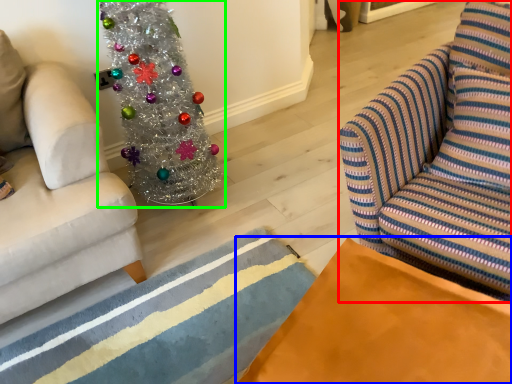
Question: Which object is the farthest from swivel chair (highlighted by a red box)? Choose among these: table (highlighted by a blue box) or christmas tree (highlighted by a green box).

Choices:
 (A) table
 (B) christmas tree

Answer: (B)